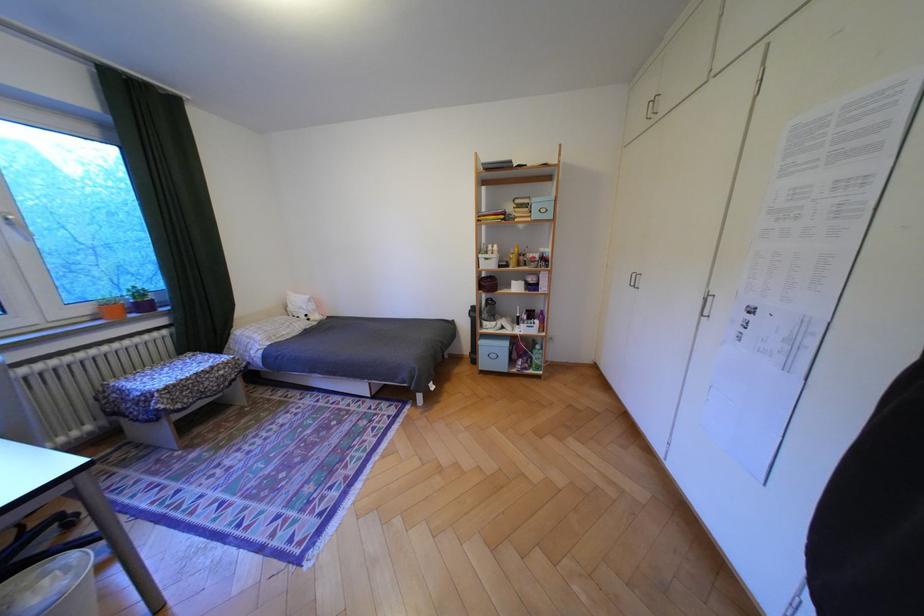
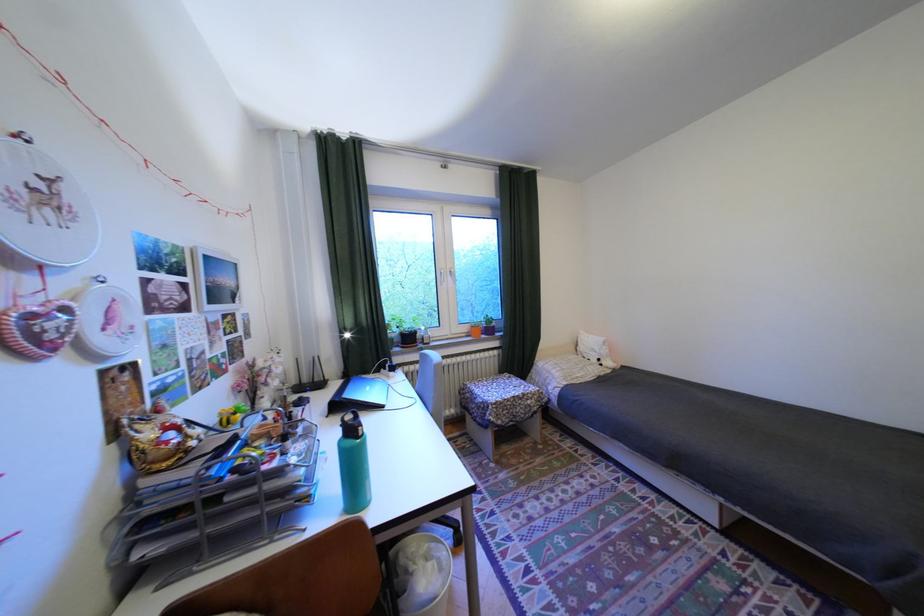
In the second image, find the point that corresponds to (x=319, y=315) in the first image.

(611, 360)